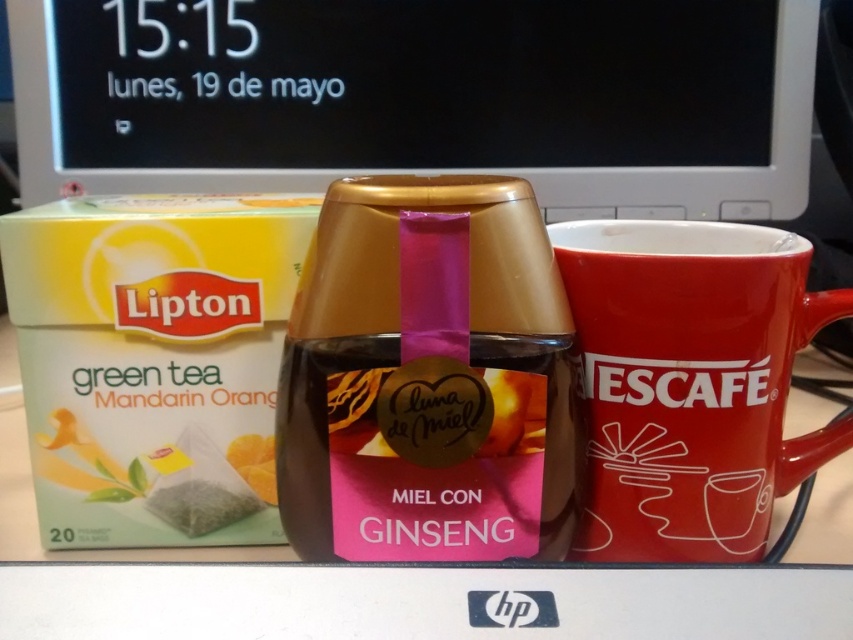
Question: Does pink glossy jar at center have a greater width compared to red ceramic mug at center?

Choices:
 (A) no
 (B) yes

Answer: (A)

Question: Estimate the real-world distances between objects in this image. Which object is closer to the matte plastic laptop at upper center?

Choices:
 (A) red ceramic mug at center
 (B) pink glossy jar at center

Answer: (A)

Question: Can you confirm if pink glossy jar at center is positioned above red ceramic mug at center?

Choices:
 (A) no
 (B) yes

Answer: (A)

Question: Which object is closer to the camera taking this photo?

Choices:
 (A) red ceramic mug at center
 (B) matte plastic laptop at upper center
 (C) pink glossy jar at center

Answer: (C)

Question: Is matte plastic laptop at upper center above pink glossy jar at center?

Choices:
 (A) no
 (B) yes

Answer: (B)

Question: Which point is closer to the camera taking this photo?

Choices:
 (A) (x=438, y=220)
 (B) (x=589, y=360)
 (C) (x=186, y=113)

Answer: (A)